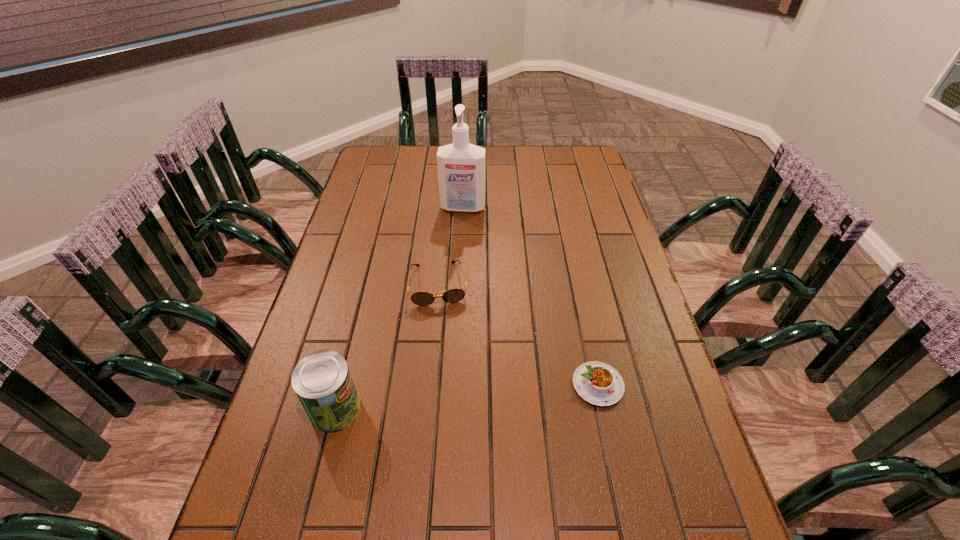
The height and width of the screenshot is (540, 960). In the image, there is a desktop. In order to click on free space at the right edge in this screenshot , I will do `click(623, 348)`.

Where is `blank space at the far left corner of the desktop`? blank space at the far left corner of the desktop is located at coordinates (374, 151).

The image size is (960, 540). I want to click on empty location between the third shortest object and the rightmost object, so click(467, 397).

Locate an element on the screen. free space between the third tallest object and the tallest object is located at coordinates click(451, 246).

Image resolution: width=960 pixels, height=540 pixels. Find the location of `unoccupied position between the pudding and the tallest object`. unoccupied position between the pudding and the tallest object is located at coordinates (530, 296).

The width and height of the screenshot is (960, 540). Find the location of `free space between the pudding and the farthest object`. free space between the pudding and the farthest object is located at coordinates (530, 296).

Identify the location of free space between the tallest object and the pudding. 530,296.

The image size is (960, 540). I want to click on vacant space that's between the pudding and the cleansing agent, so click(530, 296).

You are a GUI agent. You are given a task and a screenshot of the screen. Output one action in this format:
    pyautogui.click(x=<x>, y=<y>)
    Task: Click on the free spot between the second tallest object and the farthest object
    The width and height of the screenshot is (960, 540).
    Given the screenshot: What is the action you would take?
    pyautogui.click(x=399, y=308)

Identify the location of unoccupied position between the shortest object and the sunglasses. The width and height of the screenshot is (960, 540). (518, 334).